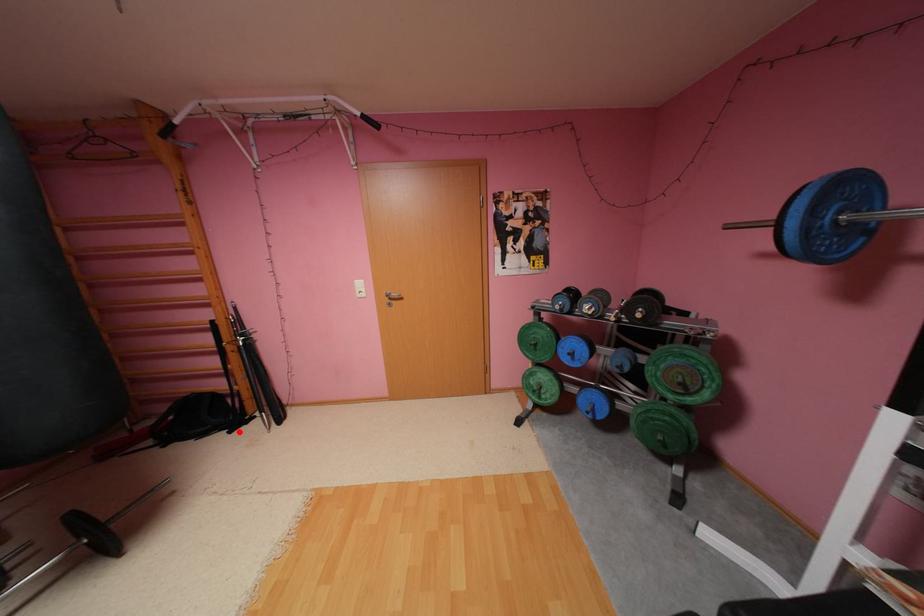
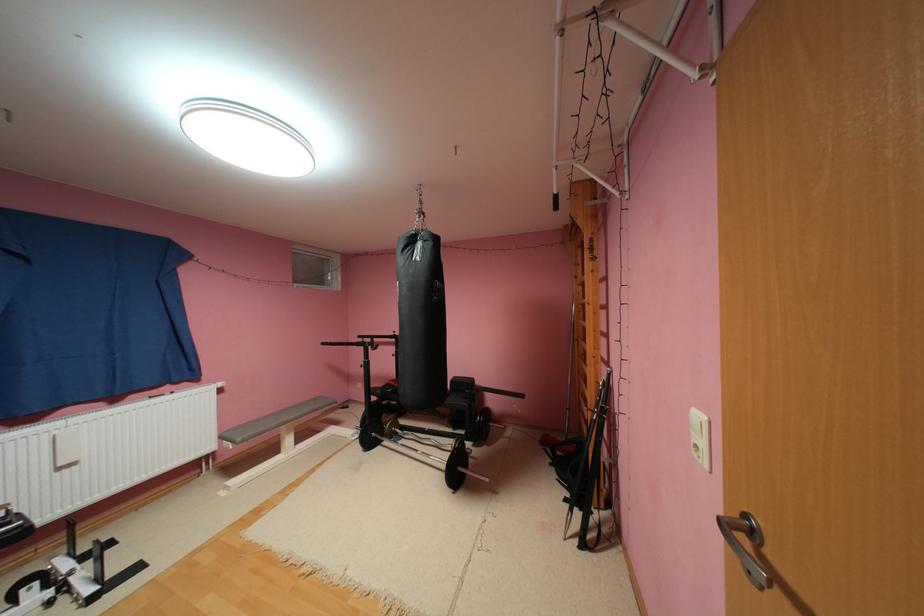
In the second image, find the point that corresponds to the highlighted location in the first image.

(575, 500)